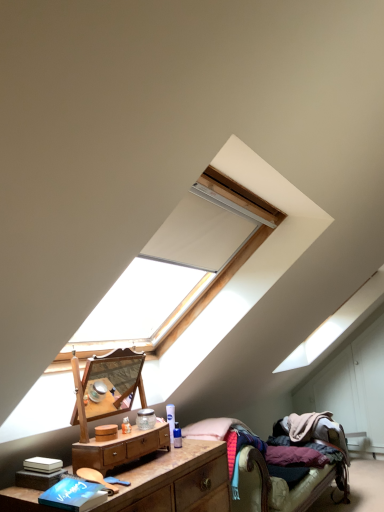
Question: Is wooden nightstand at lower left, the second nightstand viewed from the top, facing away from textured fabric bed at lower right?

Choices:
 (A) yes
 (B) no

Answer: (B)

Question: From the image's perspective, is wooden nightstand at lower left, placed as the first nightstand when sorted from bottom to top, under textured fabric bed at lower right?

Choices:
 (A) no
 (B) yes

Answer: (A)

Question: From a real-world perspective, is wooden nightstand at lower left, the second nightstand viewed from the top, beneath textured fabric bed at lower right?

Choices:
 (A) yes
 (B) no

Answer: (B)

Question: Does wooden nightstand at lower left, the second nightstand viewed from the top, have a larger size compared to textured fabric bed at lower right?

Choices:
 (A) no
 (B) yes

Answer: (A)

Question: Is textured fabric bed at lower right completely or partially inside wooden nightstand at lower left, placed as the first nightstand when sorted from bottom to top?

Choices:
 (A) yes
 (B) no

Answer: (B)

Question: In the image, is textured fabric bed at lower right positioned in front of or behind blue matte book at lower left?

Choices:
 (A) behind
 (B) front

Answer: (A)

Question: Is textured fabric bed at lower right inside or outside of blue matte book at lower left?

Choices:
 (A) inside
 (B) outside

Answer: (B)

Question: Considering the positions of textured fabric bed at lower right and blue matte book at lower left in the image, is textured fabric bed at lower right taller or shorter than blue matte book at lower left?

Choices:
 (A) short
 (B) tall

Answer: (B)

Question: From the image's perspective, is textured fabric bed at lower right above or below blue matte book at lower left?

Choices:
 (A) above
 (B) below

Answer: (B)

Question: From a real-world perspective, is blue matte book at lower left physically located above or below textured fabric bed at lower right?

Choices:
 (A) below
 (B) above

Answer: (B)

Question: Is blue matte book at lower left wider or thinner than textured fabric bed at lower right?

Choices:
 (A) thin
 (B) wide

Answer: (A)

Question: From their relative heights in the image, would you say blue matte book at lower left is taller or shorter than textured fabric bed at lower right?

Choices:
 (A) short
 (B) tall

Answer: (A)

Question: Considering their positions, is blue matte book at lower left located in front of or behind textured fabric bed at lower right?

Choices:
 (A) front
 (B) behind

Answer: (A)

Question: Is blue matte book at lower left wider or thinner than wooden polished nightstand at center, the 2th nightstand ordered from the bottom?

Choices:
 (A) wide
 (B) thin

Answer: (A)

Question: Visually, is blue matte book at lower left positioned to the left or to the right of wooden polished nightstand at center, the first nightstand in the top-to-bottom sequence?

Choices:
 (A) right
 (B) left

Answer: (B)